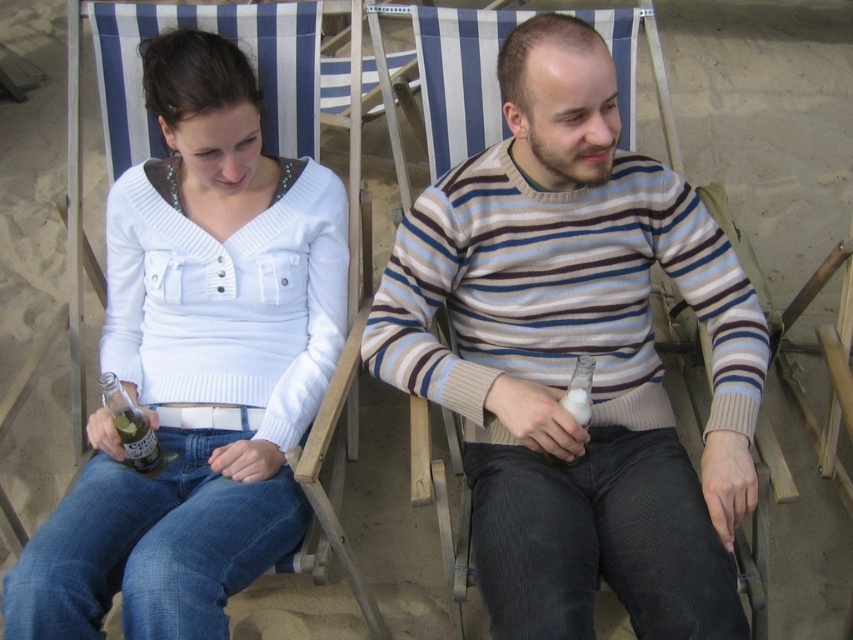
You are a photographer taking a picture of the scene. You notice the white matte sweater at upper left and the clear glass bottle at center. Which object will appear closer to the camera in the photo?

The white matte sweater at upper left will appear closer to the camera because it is in front of the clear glass bottle at center.

You are a photographer trying to capture both the striped sweater at center and the white matte sweater at upper left in a single frame. Since you want both sweaters to appear equally prominent, which sweater should you move closer to the camera and why?

You should move the white matte sweater at upper left closer to the camera because the striped sweater at center is larger in size than the white matte sweater at upper left. By moving the smaller sweater closer, it will appear larger in the photo, balancing their prominence.